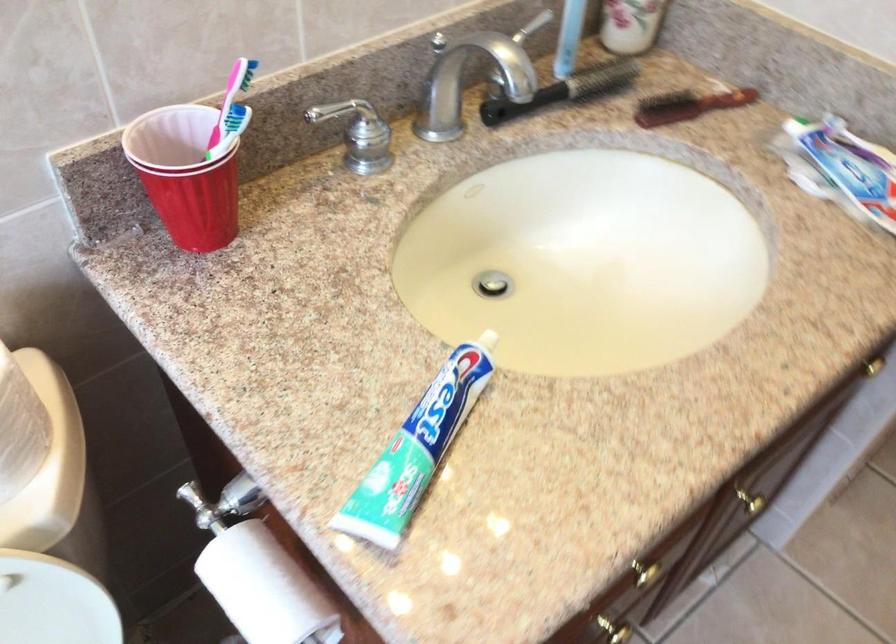
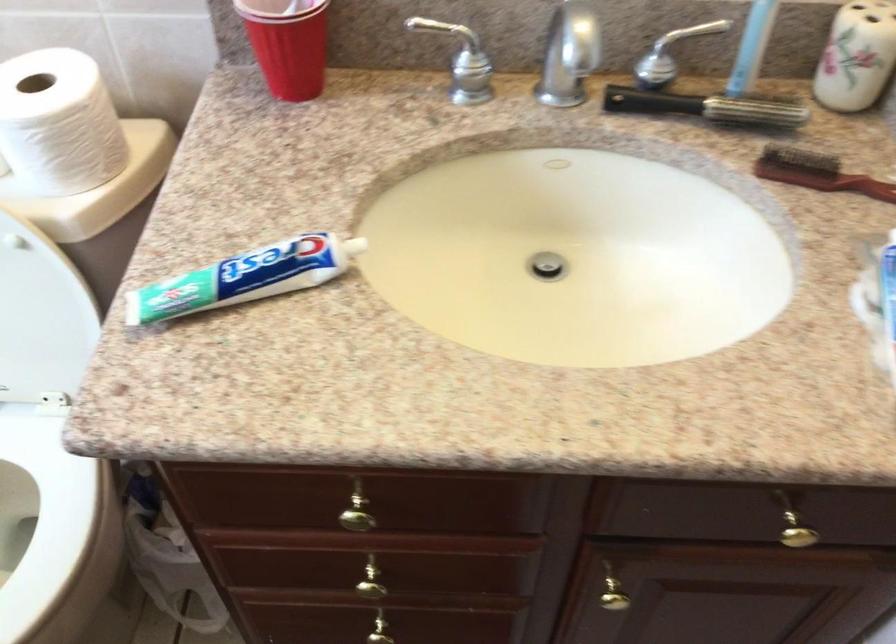
In the second image, find the point that corresponds to pixel 212 187 in the first image.

(288, 44)